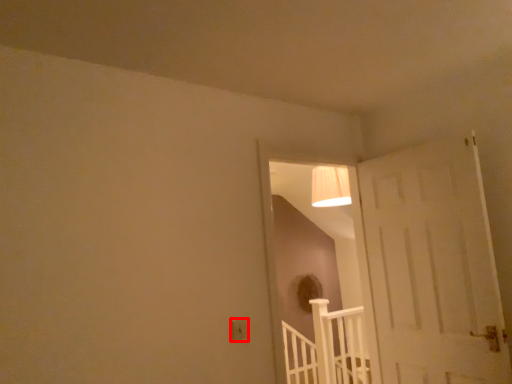
Question: From the image's perspective, considering the relative positions of electric outlet (annotated by the red box) and rail in the image provided, where is electric outlet (annotated by the red box) located with respect to the staircase?

Choices:
 (A) below
 (B) above

Answer: (B)